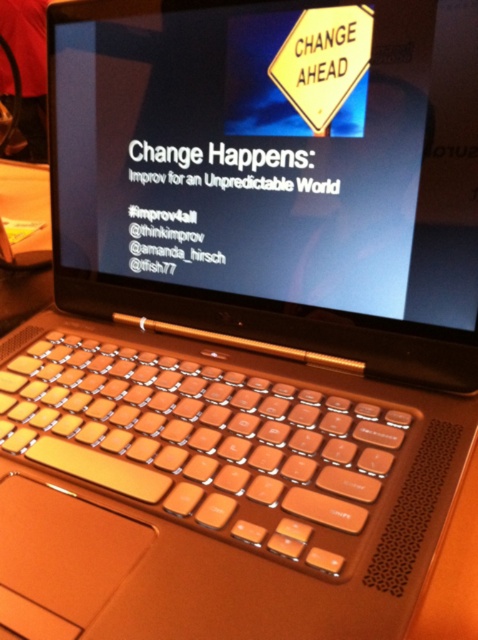
Question: Is matte black laptop at center to the right of orange plastic keyboard at center from the viewer's perspective?

Choices:
 (A) yes
 (B) no

Answer: (A)

Question: Which point is farther to the camera?

Choices:
 (A) matte black laptop at center
 (B) orange plastic keyboard at center

Answer: (A)

Question: Which object appears closest to the camera in this image?

Choices:
 (A) matte black laptop at center
 (B) orange plastic keyboard at center

Answer: (B)

Question: Is matte black laptop at center above orange plastic keyboard at center?

Choices:
 (A) yes
 (B) no

Answer: (A)

Question: Does matte black laptop at center appear under orange plastic keyboard at center?

Choices:
 (A) yes
 (B) no

Answer: (B)

Question: Which point is closer to the camera?

Choices:
 (A) (283, 490)
 (B) (423, 250)

Answer: (A)